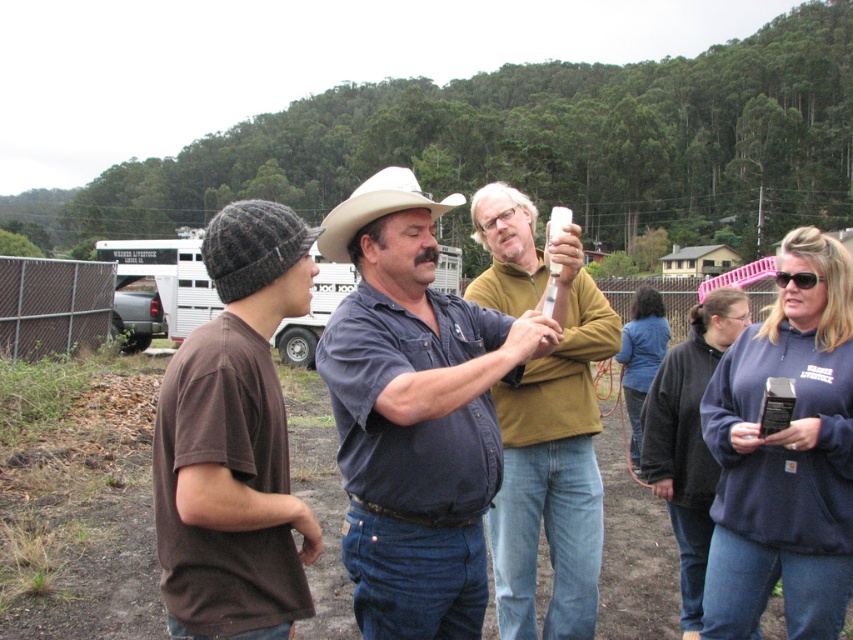
Is brown knit beanie at left to the right of matte yellow shirt at center from the viewer's perspective?

In fact, brown knit beanie at left is to the left of matte yellow shirt at center.

Who is more distant from viewer, (294, 586) or (514, 529)?

Point (514, 529)

This screenshot has width=853, height=640. I want to click on brown knit beanie at left, so click(x=234, y=442).

How far apart are matte yellow shirt at center and white matte cowboy hat at center?

9.47 meters

Who is more distant from viewer, (x=519, y=560) or (x=448, y=196)?

The point (x=448, y=196) is more distant.

Which is behind, point (526, 308) or point (415, 177)?

The point (415, 177) is more distant.

You are a GUI agent. You are given a task and a screenshot of the screen. Output one action in this format:
    pyautogui.click(x=<x>, y=<y>)
    Task: Click on the matte yellow shirt at center
    The height and width of the screenshot is (640, 853).
    Given the screenshot: What is the action you would take?
    pyautogui.click(x=553, y=467)

Is blue denim jeans at center thinner than brown knit beanie at left?

No.

Which is more to the right, blue denim jeans at center or brown knit beanie at left?

From the viewer's perspective, brown knit beanie at left appears more on the right side.

Locate an element on the screen. blue denim jeans at center is located at coordinates (415, 413).